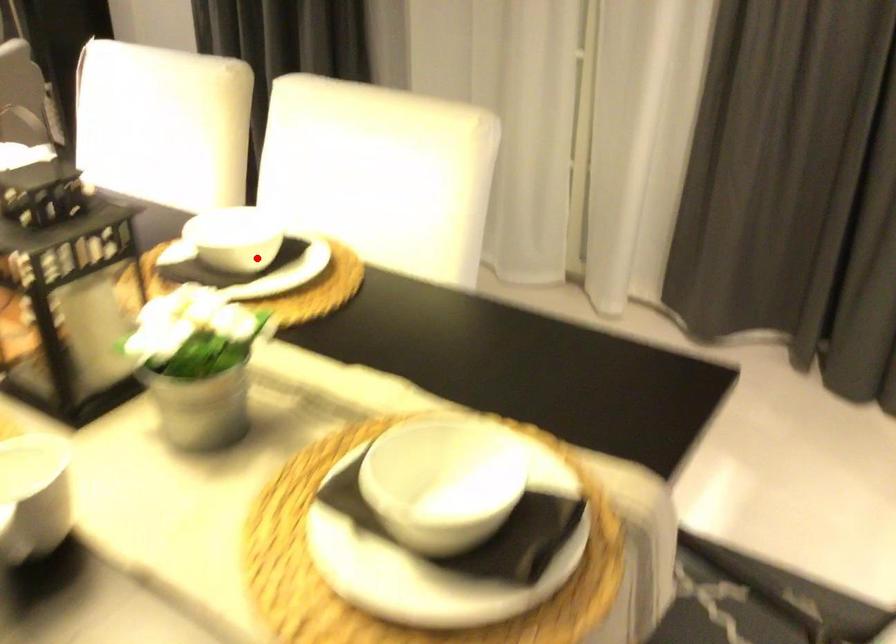
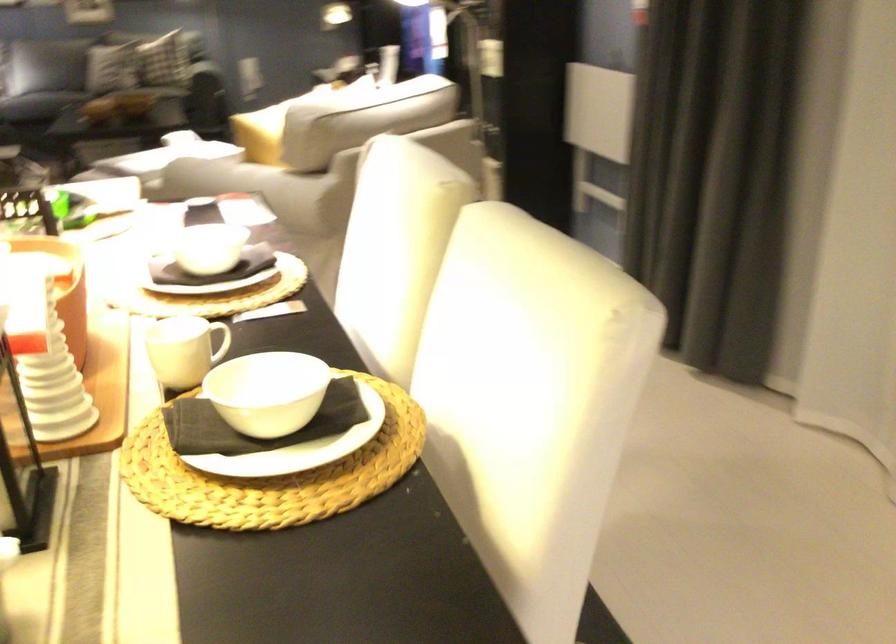
In the second image, find the point that corresponds to the highlighted location in the first image.

(259, 424)